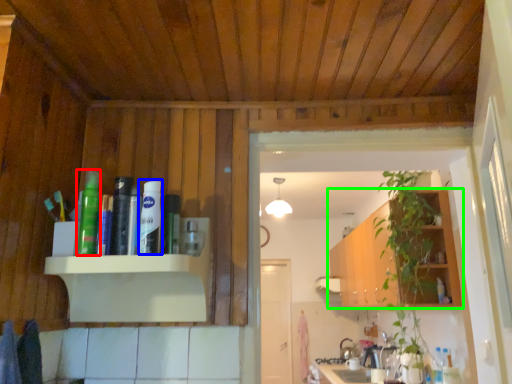
Question: Which is nearer to the toiletry (highlighted by a red box)? toiletry (highlighted by a blue box) or cabinetry (highlighted by a green box).

Choices:
 (A) toiletry
 (B) cabinetry

Answer: (A)